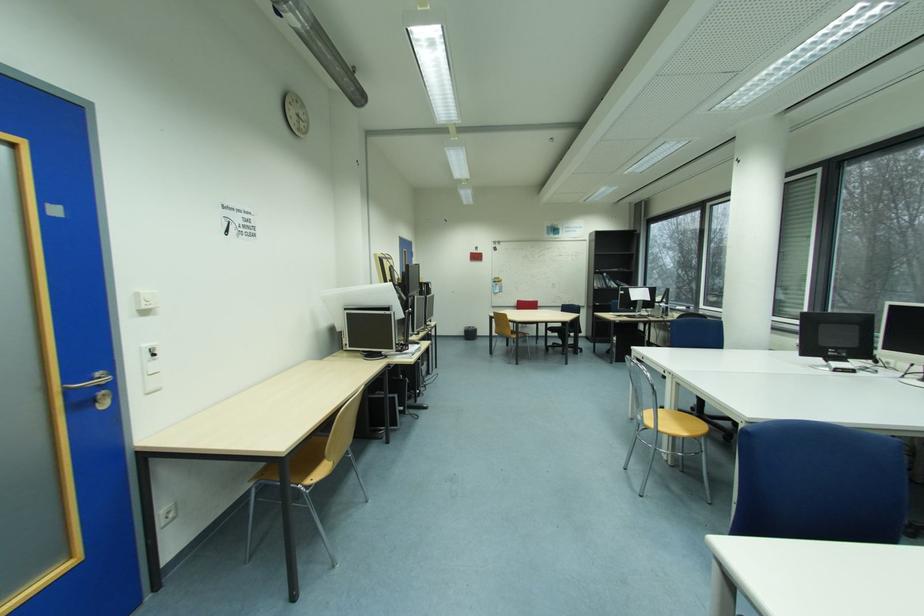
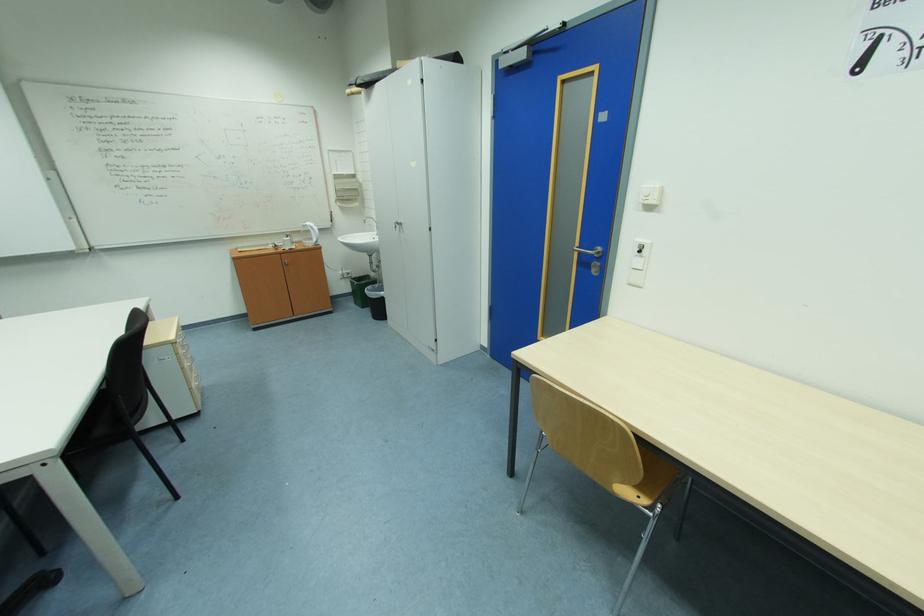
Find the pixel in the second image that matches the point at 89,405 in the first image.

(590, 264)